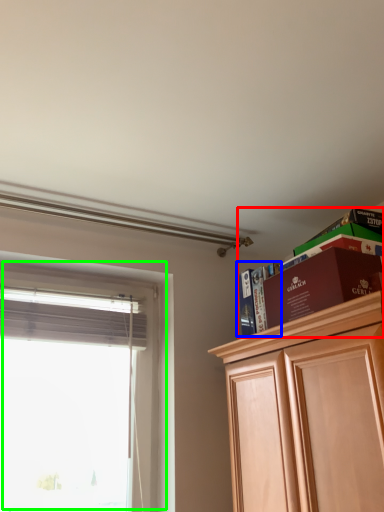
Question: Based on their relative distances, which object is nearer to shelf (highlighted by a red box)? Choose from book (highlighted by a blue box) and window (highlighted by a green box).

Choices:
 (A) book
 (B) window

Answer: (A)